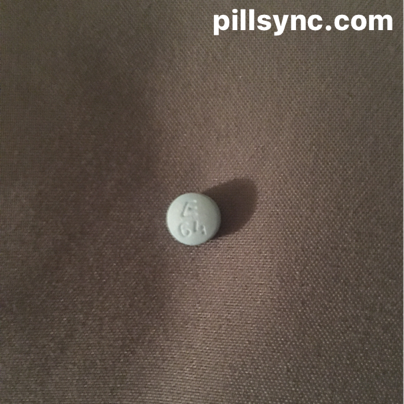
This screenshot has width=404, height=404. In order to click on floor in this screenshot , I will do `click(322, 158)`.